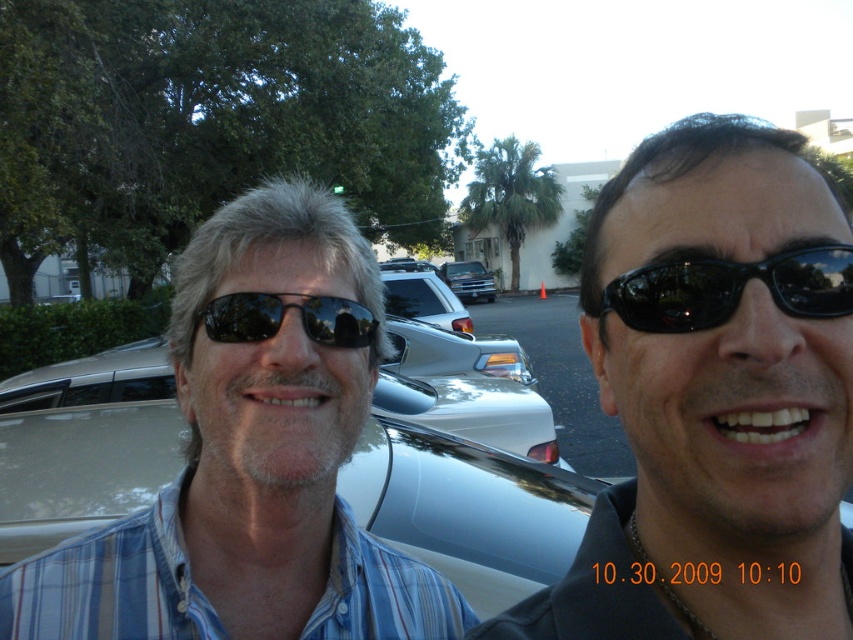
Is blue plaid shirt at left positioned in front of black reflective sunglasses at center?

Yes.

Between blue plaid shirt at left and black reflective sunglasses at center, which one is positioned lower?

blue plaid shirt at left is lower down.

Who is more forward, (x=344, y=301) or (x=268, y=337)?

Point (x=268, y=337) is in front.

Where is `blue plaid shirt at left`? Image resolution: width=853 pixels, height=640 pixels. blue plaid shirt at left is located at coordinates (252, 458).

Consider the image. Is blue plaid shirt at left shorter than metallic silver truck at center?

No, blue plaid shirt at left is not shorter than metallic silver truck at center.

At what (x,y) coordinates should I click in order to perform the action: click on blue plaid shirt at left. Please return your answer as a coordinate pair (x, y). The height and width of the screenshot is (640, 853). Looking at the image, I should click on (252, 458).

This screenshot has width=853, height=640. Identify the location of blue plaid shirt at left. (252, 458).

Is black glossy sunglasses at center bigger than black reflective sunglasses at right?

Yes.

Is black glossy sunglasses at center above black reflective sunglasses at right?

Incorrect, black glossy sunglasses at center is not positioned above black reflective sunglasses at right.

Does point (750, 330) come closer to viewer compared to point (833, 294)?

Yes, it is in front of point (833, 294).

Locate an element on the screen. black glossy sunglasses at center is located at coordinates (714, 397).